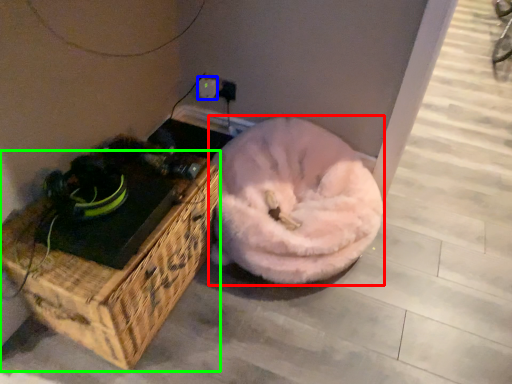
Question: Which object is the closest to the dog bed (highlighted by a red box)? Choose among these: electric outlet (highlighted by a blue box) or furniture (highlighted by a green box).

Choices:
 (A) electric outlet
 (B) furniture

Answer: (B)